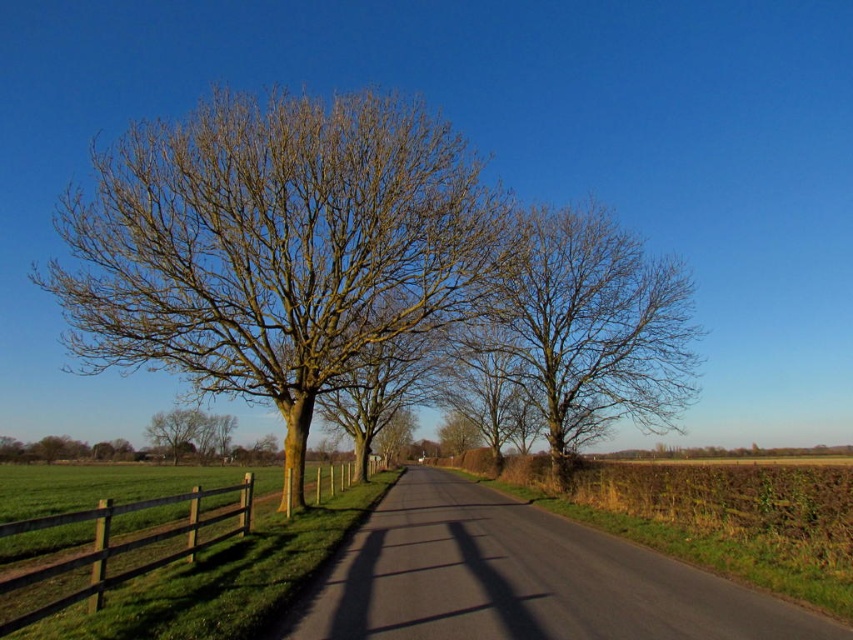
Question: Estimate the real-world distances between objects in this image. Which object is farther from the bare wood tree at center?

Choices:
 (A) green mossy tree at center
 (B) brown rough bark tree at center

Answer: (A)

Question: Does green mossy tree at center appear on the right side of bare wood tree at center?

Choices:
 (A) no
 (B) yes

Answer: (A)

Question: Does brown wooden fence at lower left lie in front of brown rough bark tree at center?

Choices:
 (A) no
 (B) yes

Answer: (B)

Question: Estimate the real-world distances between objects in this image. Which object is closer to the brown wooden fence at lower left?

Choices:
 (A) brown rough bark tree at center
 (B) green mossy tree at center

Answer: (B)

Question: Which point appears farthest from the camera in this image?

Choices:
 (A) (302, 120)
 (B) (653, 317)

Answer: (B)

Question: Can you confirm if green mossy tree at center is smaller than bare wood tree at center?

Choices:
 (A) yes
 (B) no

Answer: (A)